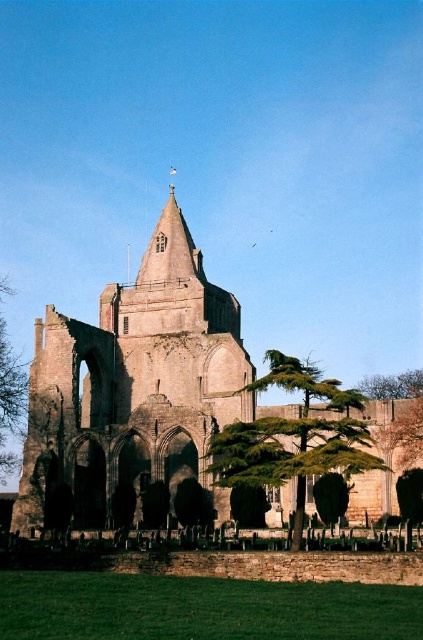
Question: Does stone steeple at center appear under green textured stone tree at center?

Choices:
 (A) no
 (B) yes

Answer: (A)

Question: Is green textured stone tree at center positioned at the back of green leafy tree at left?

Choices:
 (A) yes
 (B) no

Answer: (B)

Question: Estimate the real-world distances between objects in this image. Which object is closer to the green leafy tree at left?

Choices:
 (A) green leafy tree at lower right
 (B) green textured stone tree at center
 (C) stone steeple at center

Answer: (C)

Question: Among these points, which one is farthest from the camera?

Choices:
 (A) (16, 420)
 (B) (57, 432)

Answer: (A)

Question: Where is green textured stone tree at center located in relation to green leafy tree at left in the image?

Choices:
 (A) left
 (B) right

Answer: (B)

Question: Based on their relative distances, which object is farther from the stone steeple at center?

Choices:
 (A) green textured stone tree at center
 (B) green leafy tree at lower right
 (C) green leafy tree at left

Answer: (B)